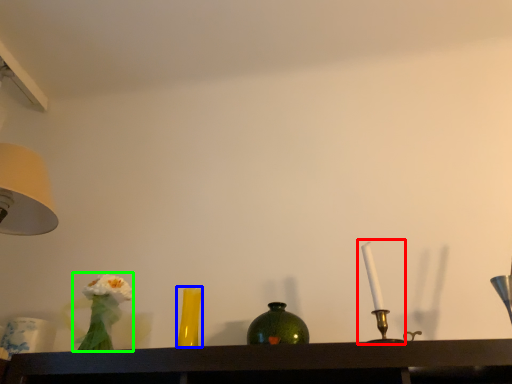
Question: Which object is the farthest from candle holder (highlighted by a red box)? Choose among these: vase (highlighted by a blue box) or floral arrangement (highlighted by a green box).

Choices:
 (A) vase
 (B) floral arrangement

Answer: (B)